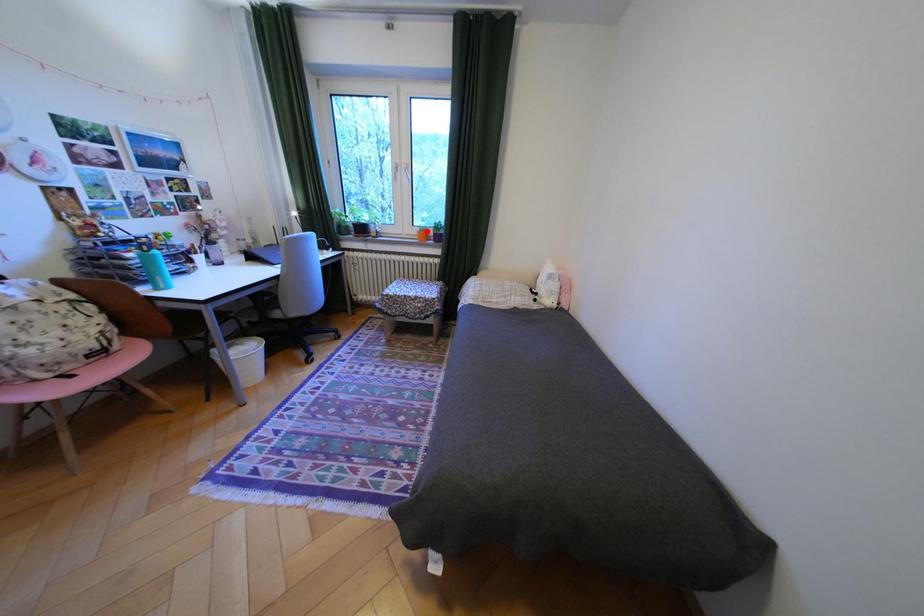
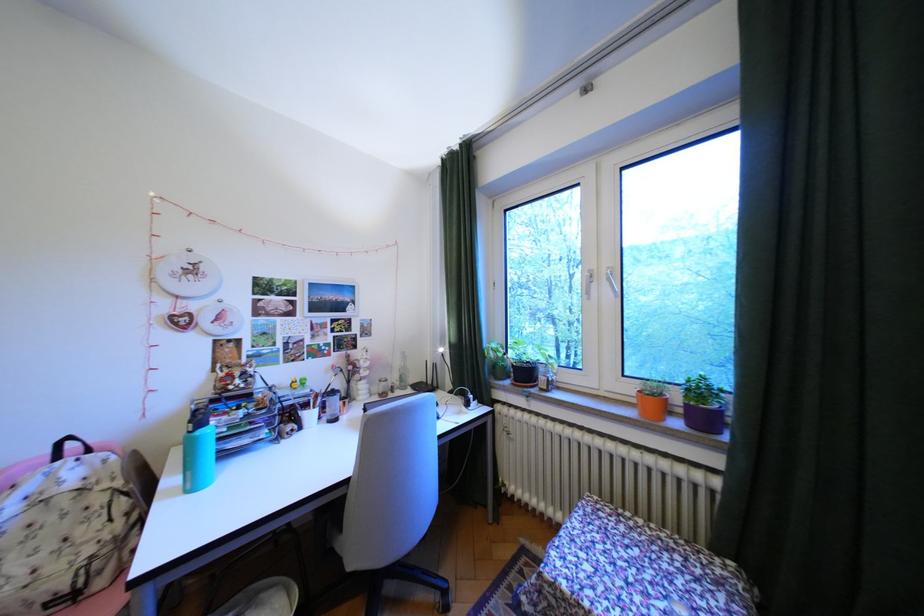
Question: I am providing you with two images of the same scene from different viewpoints. In image1, a red point is highlighted. Considering the same 3D point in image2, which of the following is correct?

Choices:
 (A) It is closer
 (B) It is farther

Answer: (B)